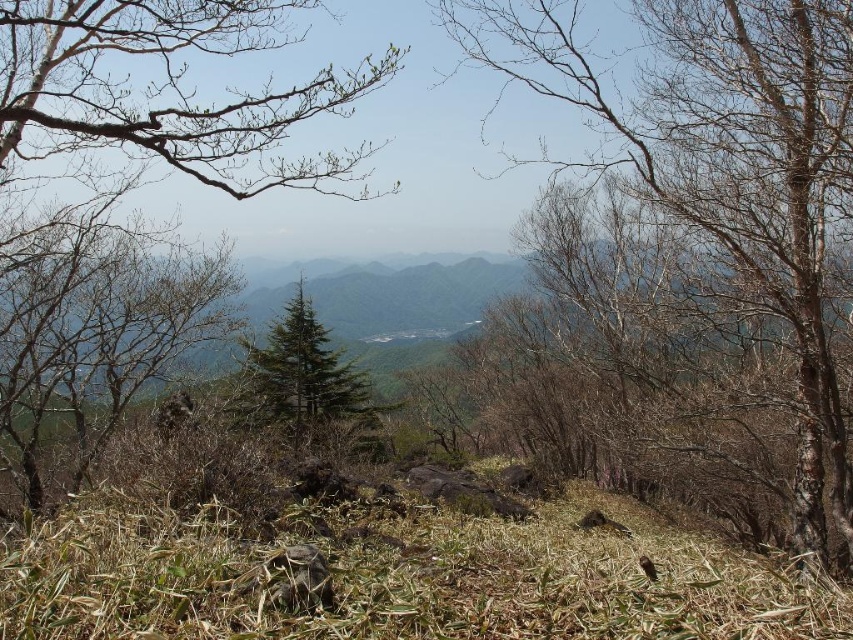
You are standing at the vantage point looking at the mountain landscape. You see the green grassy at center and the green leafy branch at upper left. Which object is closer to you?

The green grassy at center is closer to you because it is positioned below the green leafy branch at upper left, indicating it is in a lower part of the scene.

You are a hiker planning a route from the starting point at point (712, 60) to the destination at point (340, 177). Given the terrain described in the scene, which direction should you move to reach your destination?

Since point (712, 60) is in front of point (340, 177), you should move backward to reach your destination.

You are standing at the edge of a mountain trail and see the bare bark tree at center in front of you. If you want to reach the tree, how many steps would you need to take if each step covers approximately 2.5 feet?

The distance between you and the bare bark tree at center is 19.45 feet. Since each step covers 2.5 feet, you would need approximately 8 steps to reach it.